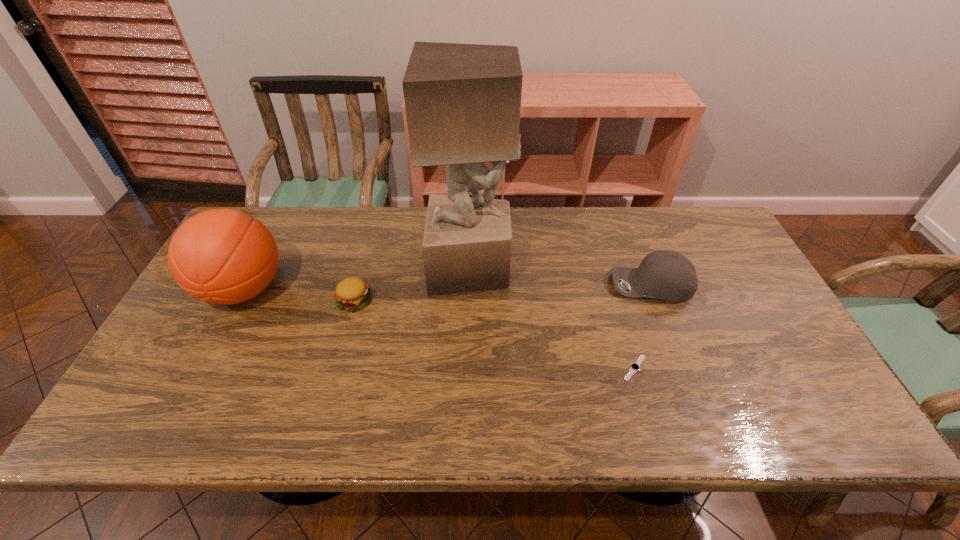
You are a GUI agent. You are given a task and a screenshot of the screen. Output one action in this format:
    pyautogui.click(x=<x>, y=<y>)
    Task: Click on the third object from right to left
    The height and width of the screenshot is (540, 960).
    Given the screenshot: What is the action you would take?
    pyautogui.click(x=462, y=101)

You are a GUI agent. You are given a task and a screenshot of the screen. Output one action in this format:
    pyautogui.click(x=<x>, y=<y>)
    Task: Click on the tallest object
    The height and width of the screenshot is (540, 960).
    Given the screenshot: What is the action you would take?
    pyautogui.click(x=462, y=101)

At what (x,y) coordinates should I click in order to perform the action: click on basketball. Please return your answer as a coordinate pair (x, y). The height and width of the screenshot is (540, 960). Looking at the image, I should click on (222, 256).

Locate an element on the screen. the second tallest object is located at coordinates (222, 256).

This screenshot has height=540, width=960. In order to click on baseball cap in this screenshot , I will do `click(667, 275)`.

This screenshot has width=960, height=540. In order to click on hamburger in this screenshot , I will do [352, 294].

Identify the location of the second object from left to right. This screenshot has height=540, width=960. (352, 294).

Identify the location of watch. (634, 367).

Find the location of `the nearest object`. the nearest object is located at coordinates (634, 367).

Find the location of a particular element. free space located 0.260m on the front-facing side of the tallest object is located at coordinates (598, 267).